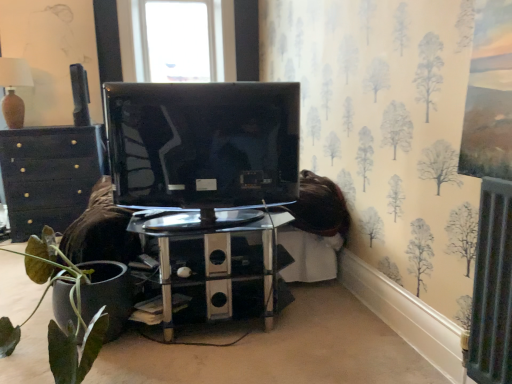
Identify the location of polished chrome table at center. The width and height of the screenshot is (512, 384). (217, 266).

Locate an element on the screen. matte brown lampshade at upper left is located at coordinates (14, 89).

What are the coordinates of `green matte plant at lower left` in the screenshot? It's located at (53, 320).

What do you see at coordinates (203, 145) in the screenshot? Image resolution: width=512 pixels, height=384 pixels. I see `glossy black tv at center` at bounding box center [203, 145].

The image size is (512, 384). I want to click on metallic gray speaker at upper left, so click(x=80, y=95).

Considering the relative positions of matte black chest of drawers at left and matte brown lampshade at upper left in the image provided, is matte black chest of drawers at left behind matte brown lampshade at upper left?

Yes.

Can you confirm if matte black chest of drawers at left is positioned to the left of matte brown lampshade at upper left?

In fact, matte black chest of drawers at left is to the right of matte brown lampshade at upper left.

Which of these two, matte black chest of drawers at left or matte brown lampshade at upper left, stands taller?

With more height is matte black chest of drawers at left.

From the image's perspective, which one is positioned higher, glossy black tv at center or polished chrome table at center?

glossy black tv at center.

Between glossy black tv at center and polished chrome table at center, which one appears on the right side from the viewer's perspective?

polished chrome table at center is more to the right.

How different are the orientations of glossy black tv at center and polished chrome table at center in degrees?

There is a 170-degree angle between the facing directions of glossy black tv at center and polished chrome table at center.

Is green matte plant at lower left facing towards metallic gray speaker at upper left?

No, green matte plant at lower left is not oriented towards metallic gray speaker at upper left.

From the picture: Would you say metallic gray speaker at upper left is part of green matte plant at lower left's contents?

No, metallic gray speaker at upper left is not inside green matte plant at lower left.

Considering the positions of objects matte black chest of drawers at left and metallic gray speaker at upper left in the image provided, who is more to the right, matte black chest of drawers at left or metallic gray speaker at upper left?

metallic gray speaker at upper left is more to the right.

Is point (42, 136) closer or farther from the camera than point (82, 101)?

Point (42, 136) is closer to the camera than point (82, 101).

Are matte black chest of drawers at left and metallic gray speaker at upper left far apart?

They are positioned close to each other.

From the picture: Considering the relative sizes of matte black chest of drawers at left and metallic gray speaker at upper left in the image provided, is matte black chest of drawers at left taller than metallic gray speaker at upper left?

Yes, matte black chest of drawers at left is taller than metallic gray speaker at upper left.

Which is in front, point (82, 90) or point (54, 282)?

The point (54, 282) is closer.

In the scene shown: Does metallic gray speaker at upper left lie behind green matte plant at lower left?

Yes, metallic gray speaker at upper left is further from the viewer.

Looking at this image, is metallic gray speaker at upper left not inside green matte plant at lower left?

Absolutely, metallic gray speaker at upper left is external to green matte plant at lower left.

Does metallic gray speaker at upper left have a lesser width compared to green matte plant at lower left?

Yes.

Based on their positions, is polished chrome table at center located to the left or right of matte black chest of drawers at left?

Based on their positions, polished chrome table at center is located to the right of matte black chest of drawers at left.

In the scene shown: From a real-world perspective, which object stands above the other?

In real-world perspective, matte black chest of drawers at left is above.

Considering the points (197, 283) and (69, 168), which point is in front, point (197, 283) or point (69, 168)?

The point (197, 283) is in front.

Is polished chrome table at center far from matte black chest of drawers at left?

Yes, polished chrome table at center is far from matte black chest of drawers at left.

Based on the photo, is matte black chest of drawers at left with glossy black tv at center?

No, matte black chest of drawers at left is not touching glossy black tv at center.

From the image's perspective, which object appears higher, matte black chest of drawers at left or glossy black tv at center?

glossy black tv at center.

From their relative heights in the image, would you say matte black chest of drawers at left is taller or shorter than glossy black tv at center?

matte black chest of drawers at left is taller than glossy black tv at center.

Measure the distance between matte black chest of drawers at left and glossy black tv at center.

They are 6.03 feet apart.

The width and height of the screenshot is (512, 384). Find the location of `the chest of drawers below the matte brown lampshade at upper left (from the image's perspective)`. the chest of drawers below the matte brown lampshade at upper left (from the image's perspective) is located at coordinates (49, 175).

Locate an element on the screen. This screenshot has width=512, height=384. table behind the glossy black tv at center is located at coordinates (217, 266).

From the image, which object appears to be farther from glossy black tv at center, metallic gray speaker at upper left or polished chrome table at center?

metallic gray speaker at upper left is further to glossy black tv at center.

Which object lies further to the anchor point green matte plant at lower left, matte brown lampshade at upper left or polished chrome table at center?

Based on the image, matte brown lampshade at upper left appears to be further to green matte plant at lower left.

When comparing their distances from metallic gray speaker at upper left, does green matte plant at lower left or matte black chest of drawers at left seem closer?

Based on the image, matte black chest of drawers at left appears to be nearer to metallic gray speaker at upper left.

Estimate the real-world distances between objects in this image. Which object is closer to green matte plant at lower left, polished chrome table at center or matte black chest of drawers at left?

Among the two, polished chrome table at center is located nearer to green matte plant at lower left.

When comparing their distances from metallic gray speaker at upper left, does polished chrome table at center or matte black chest of drawers at left seem closer?

Among the two, matte black chest of drawers at left is located nearer to metallic gray speaker at upper left.

Considering their positions, is polished chrome table at center positioned closer to matte brown lampshade at upper left than glossy black tv at center?

Among the two, glossy black tv at center is located nearer to matte brown lampshade at upper left.

Which object lies further to the anchor point glossy black tv at center, matte black chest of drawers at left or matte brown lampshade at upper left?

matte brown lampshade at upper left lies further to glossy black tv at center than the other object.

From the picture: When comparing their distances from glossy black tv at center, does green matte plant at lower left or polished chrome table at center seem closer?

polished chrome table at center is closer to glossy black tv at center.

You are a GUI agent. You are given a task and a screenshot of the screen. Output one action in this format:
    pyautogui.click(x=<x>, y=<y>)
    Task: Click on the lamp between green matte plant at lower left and matte black chest of drawers at left in the front-back direction
    
    Given the screenshot: What is the action you would take?
    pyautogui.click(x=14, y=89)

The height and width of the screenshot is (384, 512). I want to click on chest of drawers between green matte plant at lower left and metallic gray speaker at upper left along the z-axis, so click(49, 175).

Where is `television between matte brown lampshade at upper left and polished chrome table at center in the horizontal direction`? This screenshot has width=512, height=384. television between matte brown lampshade at upper left and polished chrome table at center in the horizontal direction is located at coordinates (203, 145).

Identify the location of table positioned between glossy black tv at center and matte black chest of drawers at left from near to far. (217, 266).